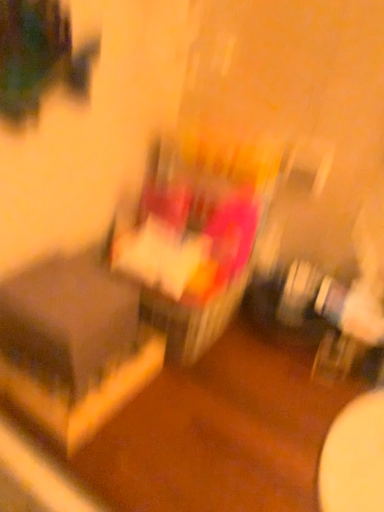
You are a GUI agent. You are given a task and a screenshot of the screen. Output one action in this format:
    pyautogui.click(x=<x>, y=<y>)
    Task: Click on the free space above matte black table at left (from a real-world perspective)
    
    Given the screenshot: What is the action you would take?
    pyautogui.click(x=54, y=298)